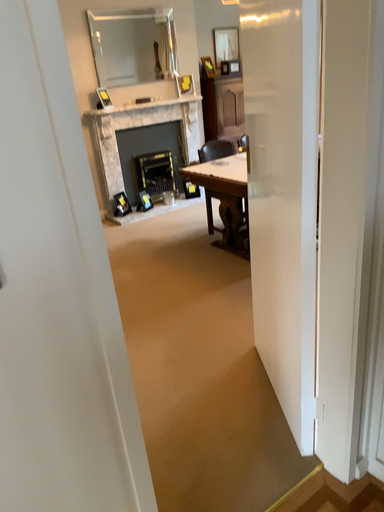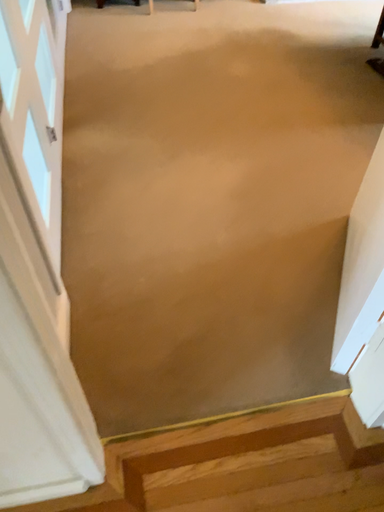
Question: Which way did the camera rotate in the video?

Choices:
 (A) rotated left
 (B) rotated right

Answer: (A)